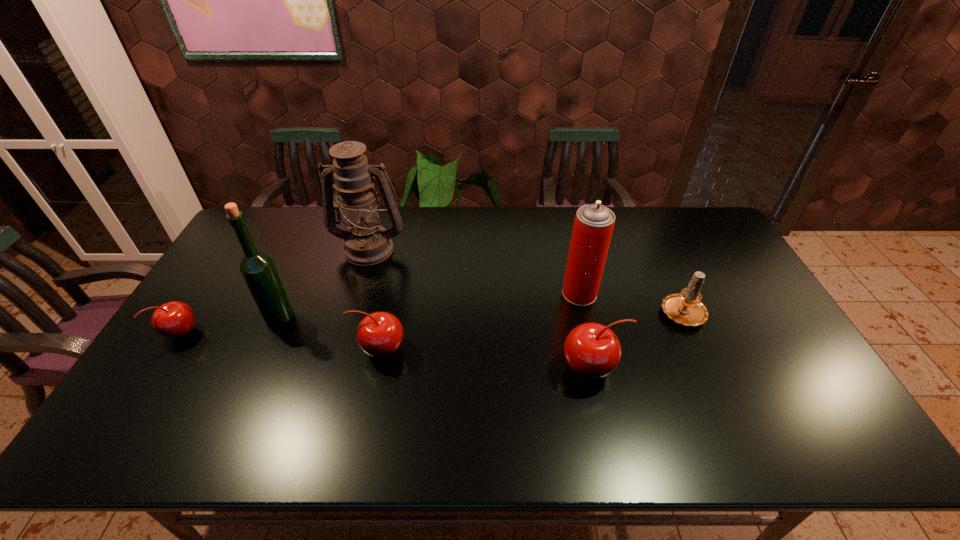
Please show where to add a cherry on the right while keeping spacing even. Please provide its 2D coordinates. Your answer should be formatted as a tuple, i.e. [(x, y)], where the tuple contains the x and y coordinates of a point satisfying the conditions above.

[(822, 389)]